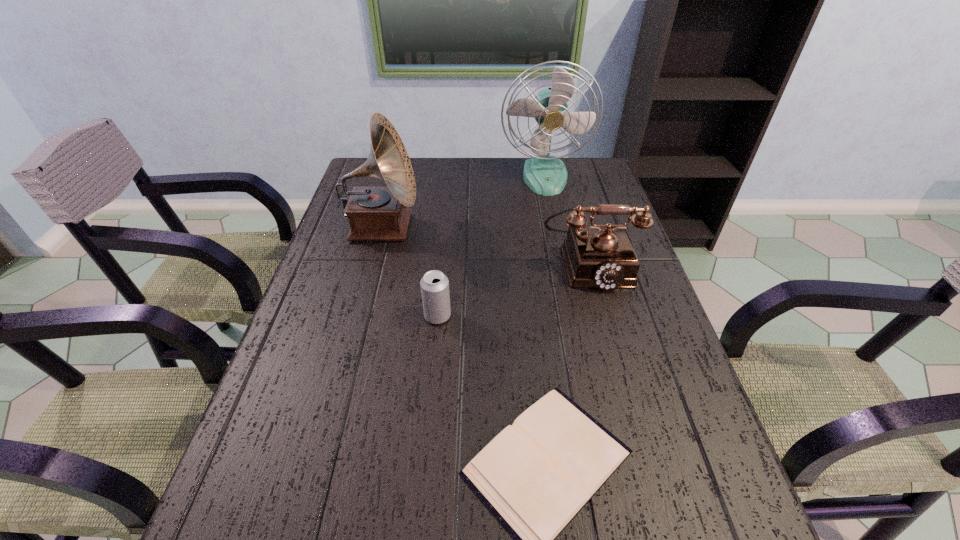
Select which object appears as the fourth closest to the fan. Please provide its 2D coordinates. Your answer should be formatted as a tuple, i.e. [(x, y)], where the tuple contains the x and y coordinates of a point satisfying the conditions above.

[(535, 476)]

Choose which object is the nearest neighbor to the fan. Please provide its 2D coordinates. Your answer should be formatted as a tuple, i.e. [(x, y)], where the tuple contains the x and y coordinates of a point satisfying the conditions above.

[(600, 256)]

At what (x,y) coordinates should I click in order to perform the action: click on blank space that satisfies the following two spatial constraints: 1. in front of the farthest object, directing airflow; 2. on the horn of the leftmost object. Please return your answer as a coordinate pair (x, y). This screenshot has width=960, height=540. Looking at the image, I should click on [x=555, y=228].